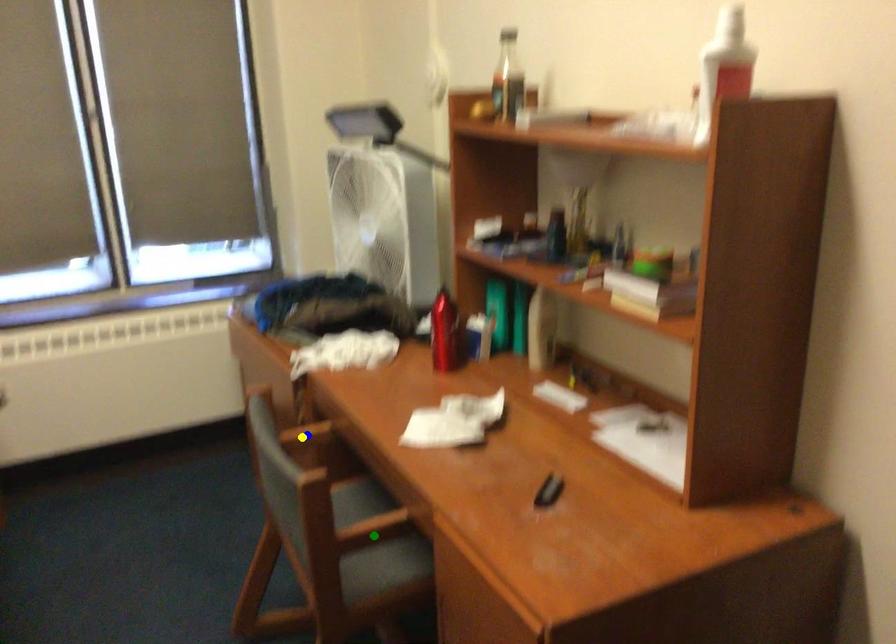
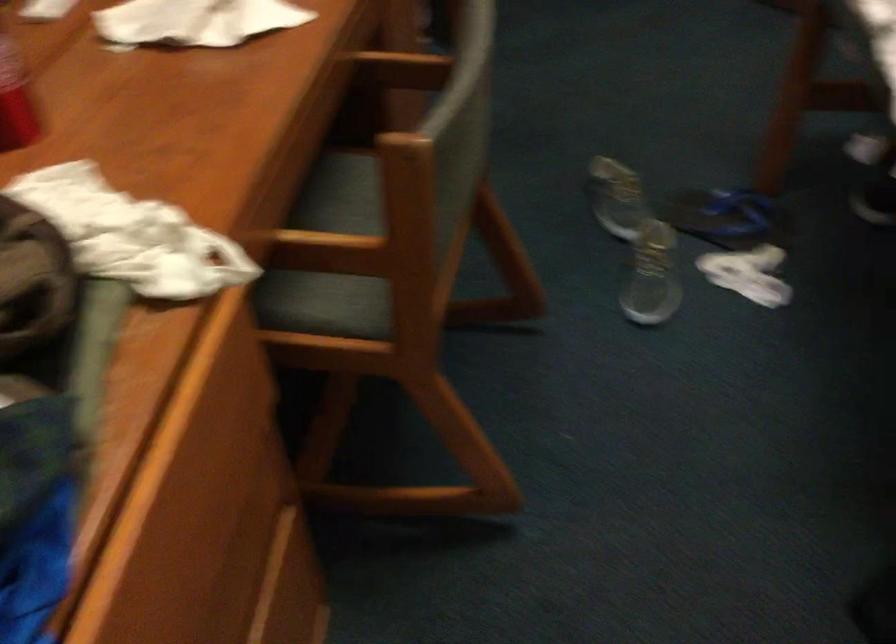
I am providing you with two images of the same scene from different viewpoints. Three points are marked in image1. Which point corresponds to a part or object that is occluded in image2?In image1, three points are marked. Which of them correspond to a part or object that is occluded in image2?Among the three points shown in image1, which one corresponds to a part or object that is no longer visible due to occlusion in image2?

blue point